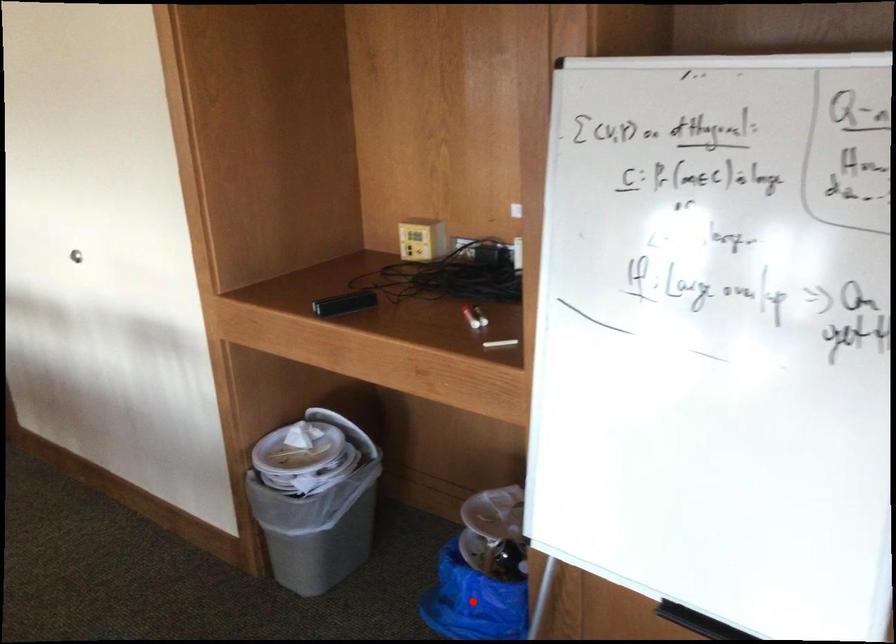
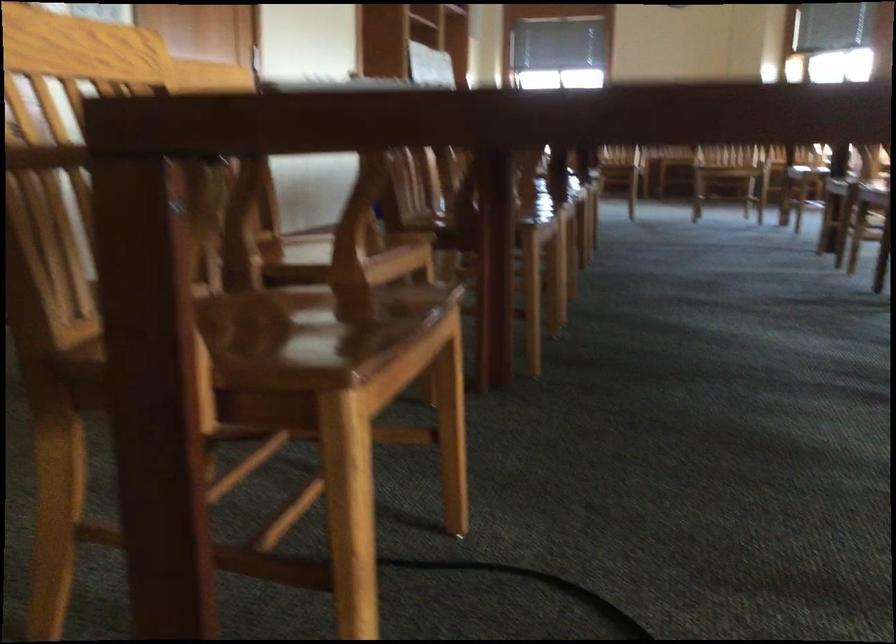
Question: I am providing you with two images of the same scene from different viewpoints. A red point is marked on the first image. Is the red point's position out of view in image 2?

Choices:
 (A) Yes
 (B) No

Answer: (A)